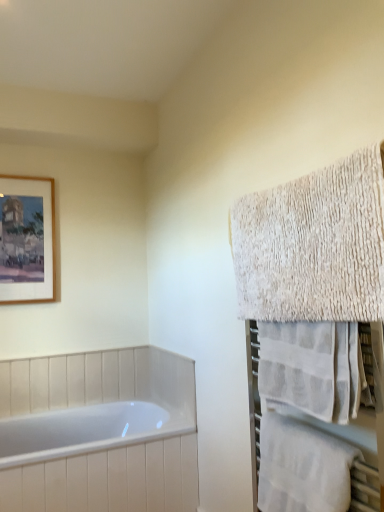
Question: Is wooden-framed painting at upper left at the right side of white textured towel at right, the third towel when ordered from bottom to top?

Choices:
 (A) no
 (B) yes

Answer: (A)

Question: Is wooden-framed painting at upper left wider than white textured towel at right, positioned as the first towel in top-to-bottom order?

Choices:
 (A) yes
 (B) no

Answer: (B)

Question: Is wooden-framed painting at upper left oriented away from white textured towel at right, the third towel when ordered from bottom to top?

Choices:
 (A) yes
 (B) no

Answer: (B)

Question: Is wooden-framed painting at upper left at the left side of white textured towel at right, the third towel when ordered from bottom to top?

Choices:
 (A) no
 (B) yes

Answer: (B)

Question: Considering the relative sizes of wooden-framed painting at upper left and white textured towel at right, positioned as the first towel in top-to-bottom order, in the image provided, is wooden-framed painting at upper left bigger than white textured towel at right, positioned as the first towel in top-to-bottom order,?

Choices:
 (A) no
 (B) yes

Answer: (A)

Question: From a real-world perspective, is white textured towel at right, the third towel when ordered from bottom to top, physically located above or below white textured towel at right, which is the 3th towel from top to bottom?

Choices:
 (A) below
 (B) above

Answer: (B)

Question: Considering their positions, is white textured towel at right, positioned as the first towel in top-to-bottom order, located in front of or behind white textured towel at right, the 1th towel positioned from the bottom?

Choices:
 (A) front
 (B) behind

Answer: (A)

Question: In terms of size, does white textured towel at right, positioned as the first towel in top-to-bottom order, appear bigger or smaller than white textured towel at right, which is the 3th towel from top to bottom?

Choices:
 (A) small
 (B) big

Answer: (B)

Question: Is white textured towel at right, positioned as the first towel in top-to-bottom order, wider or thinner than white textured towel at right, the 1th towel positioned from the bottom?

Choices:
 (A) wide
 (B) thin

Answer: (B)

Question: From the image's perspective, relative to white textured towel at right, which is counted as the 2th towel, starting from the bottom, is white textured towel at right, positioned as the first towel in top-to-bottom order, above or below?

Choices:
 (A) above
 (B) below

Answer: (A)

Question: Looking at their shapes, would you say white textured towel at right, positioned as the first towel in top-to-bottom order, is wider or thinner than white textured towel at right, which is counted as the 2th towel, starting from the bottom?

Choices:
 (A) thin
 (B) wide

Answer: (A)

Question: Is white textured towel at right, the third towel when ordered from bottom to top, taller or shorter than white textured towel at right, which is counted as the 2th towel, starting from the bottom?

Choices:
 (A) tall
 (B) short

Answer: (A)

Question: In terms of size, does white textured towel at right, positioned as the first towel in top-to-bottom order, appear bigger or smaller than white textured towel at right, which is counted as the 2th towel, starting from the bottom?

Choices:
 (A) small
 (B) big

Answer: (B)

Question: Is point (1, 297) positioned closer to the camera than point (336, 391)?

Choices:
 (A) farther
 (B) closer

Answer: (A)

Question: Is wooden-framed painting at upper left bigger or smaller than white textured towel at right, which is counted as the 2th towel, starting from the bottom?

Choices:
 (A) small
 (B) big

Answer: (A)